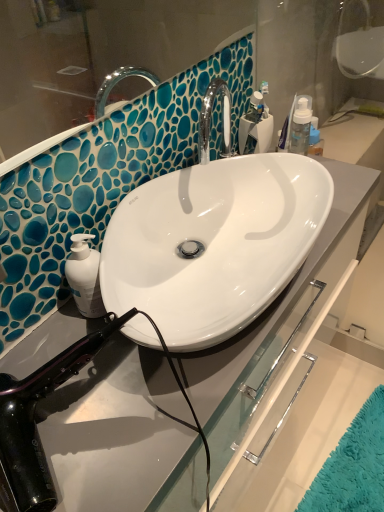
Question: From a real-world perspective, is clear plastic toothbrush holder at upper right physically located above or below black glossy hair dryer at lower left?

Choices:
 (A) above
 (B) below

Answer: (B)

Question: Considering the positions of point (259, 133) and point (66, 372), is point (259, 133) closer or farther from the camera than point (66, 372)?

Choices:
 (A) farther
 (B) closer

Answer: (A)

Question: Is clear plastic toothbrush holder at upper right to the left or to the right of black glossy hair dryer at lower left in the image?

Choices:
 (A) right
 (B) left

Answer: (A)

Question: In terms of size, does black glossy hair dryer at lower left appear bigger or smaller than clear plastic toothbrush holder at upper right?

Choices:
 (A) big
 (B) small

Answer: (A)

Question: From a real-world perspective, is black glossy hair dryer at lower left above or below clear plastic toothbrush holder at upper right?

Choices:
 (A) below
 (B) above

Answer: (B)

Question: Does point (18, 500) appear closer or farther from the camera than point (271, 132)?

Choices:
 (A) closer
 (B) farther

Answer: (A)

Question: From the image's perspective, is black glossy hair dryer at lower left above or below clear plastic toothbrush holder at upper right?

Choices:
 (A) below
 (B) above

Answer: (A)